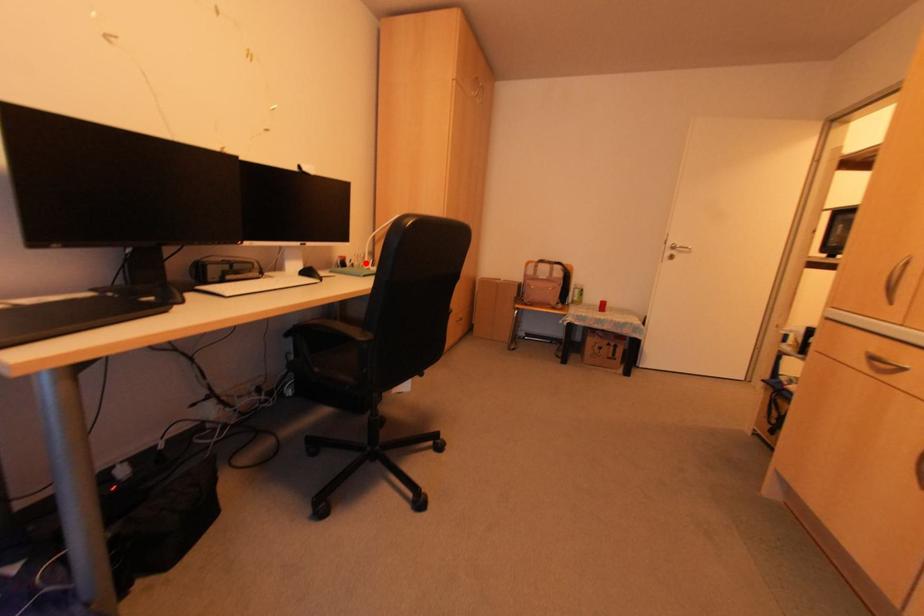
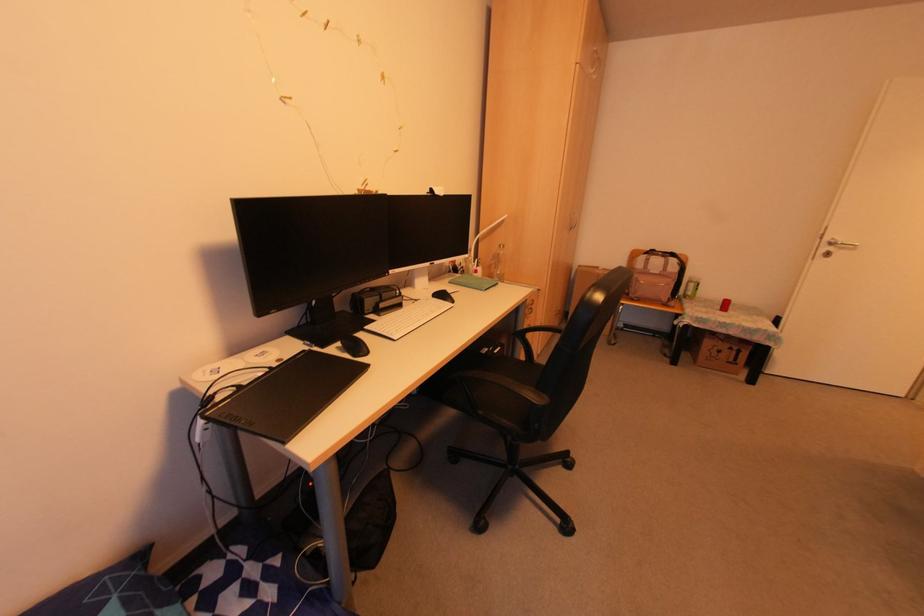
Find the pixel in the second image that matches the highlighted location in the first image.

(472, 262)